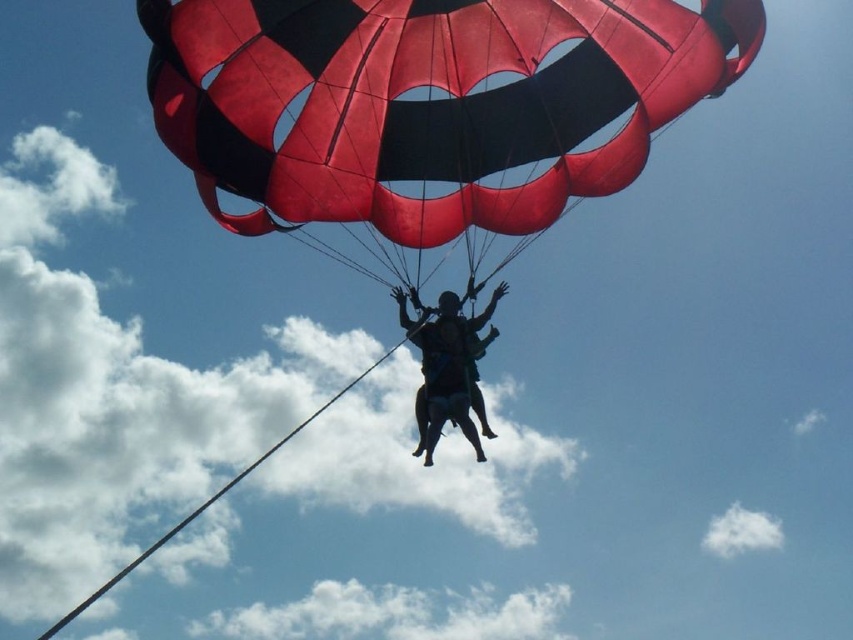
You are a drone operator trying to capture the best aerial shot of the parasailing scene. You have two points marked on your screen at coordinates point (341, 61) and point (436, 424). Which point should you focus on first if you want to follow the path of the parasailers from front to back?

Point (341, 61) is in front of point (436, 424), so you should focus on point (341, 61) first to follow the path from front to back.